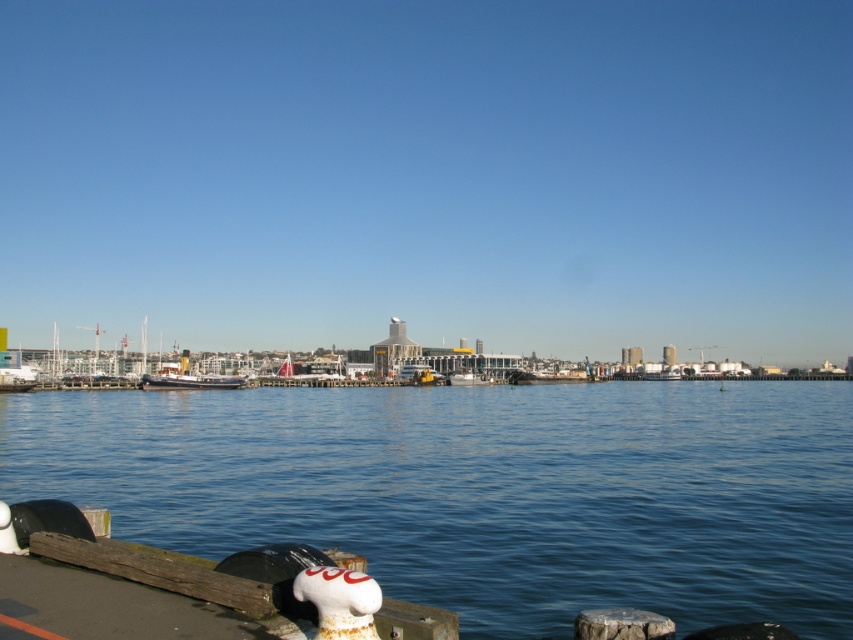
Question: Which object is farther from the camera taking this photo?

Choices:
 (A) blue water at center
 (B) white matte boat at center

Answer: (B)

Question: Is blue water at center above white matte boat at center?

Choices:
 (A) no
 (B) yes

Answer: (B)

Question: Is wooden ship at center bigger than white matte boat at center?

Choices:
 (A) yes
 (B) no

Answer: (A)

Question: Considering the relative positions of blue water at center and wooden ship at center in the image provided, where is blue water at center located with respect to wooden ship at center?

Choices:
 (A) above
 (B) below

Answer: (A)

Question: Which of the following is the farthest from the observer?

Choices:
 (A) (486, 616)
 (B) (169, 374)

Answer: (B)

Question: Which is nearer to the wooden ship at center?

Choices:
 (A) white matte boat at center
 (B) blue water at center

Answer: (B)